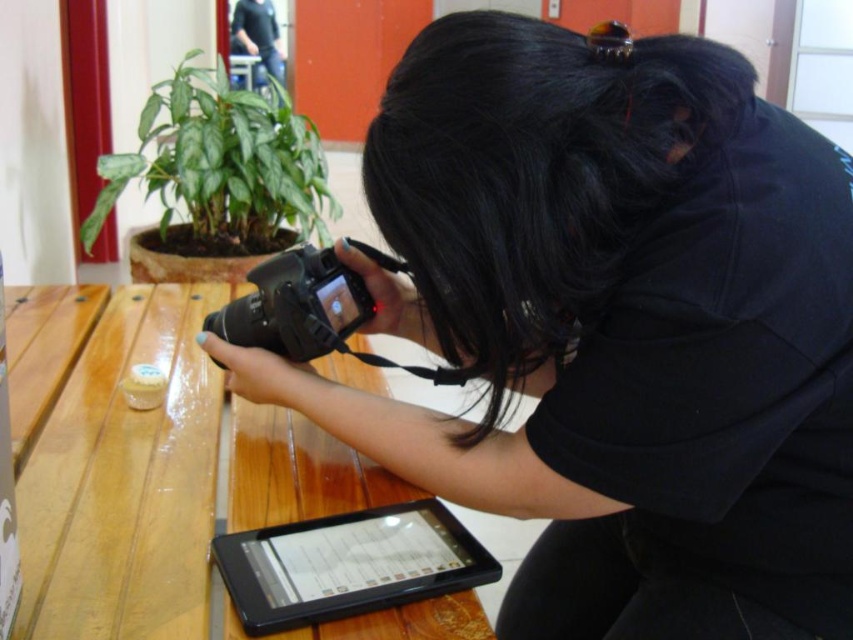
Does wooden table at center appear under dark blue shirt at upper center?

Indeed, wooden table at center is positioned under dark blue shirt at upper center.

Who is lower down, wooden table at center or dark blue shirt at upper center?

Positioned lower is wooden table at center.

Where is `wooden table at center`? The image size is (853, 640). wooden table at center is located at coordinates (125, 481).

Is wooden table at center above green matte plant at upper left?

Actually, wooden table at center is below green matte plant at upper left.

Between wooden table at center and green matte plant at upper left, which one appears on the left side from the viewer's perspective?

green matte plant at upper left is more to the left.

Is point (194, 460) less distant than point (100, 164)?

Yes, point (194, 460) is in front of point (100, 164).

Identify the location of wooden table at center. (125, 481).

Who is taller, black matte camera at center or dark blue shirt at upper center?

Standing taller between the two is dark blue shirt at upper center.

Is point (248, 337) behind point (265, 22)?

No, it is in front of (265, 22).

In order to click on black matte camera at center in this screenshot , I will do `click(296, 307)`.